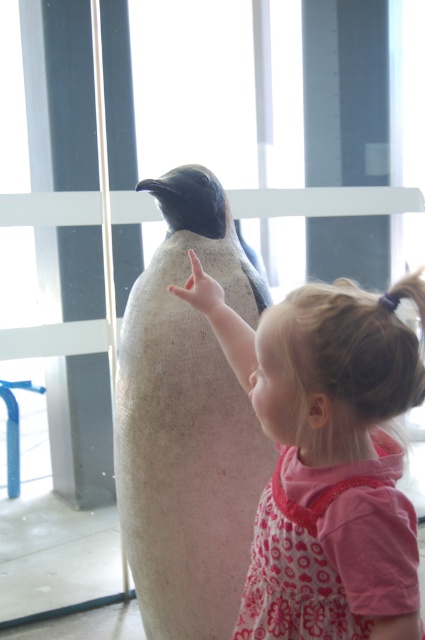
Can you confirm if pink fabric dress at center is positioned to the right of white matte penguin at center?

Correct, you'll find pink fabric dress at center to the right of white matte penguin at center.

Does pink fabric dress at center have a lesser height compared to white matte penguin at center?

Indeed, pink fabric dress at center has a lesser height compared to white matte penguin at center.

Does point (351, 326) lie behind point (172, 304)?

No, (351, 326) is in front of (172, 304).

Locate an element on the screen. pink fabric dress at center is located at coordinates (326, 458).